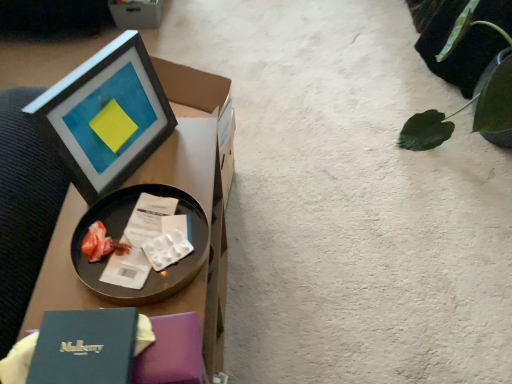
Where is `empty space that is ontop of black glossy tray at upper left (from a real-world perspective)`? The width and height of the screenshot is (512, 384). empty space that is ontop of black glossy tray at upper left (from a real-world perspective) is located at coordinates (144, 220).